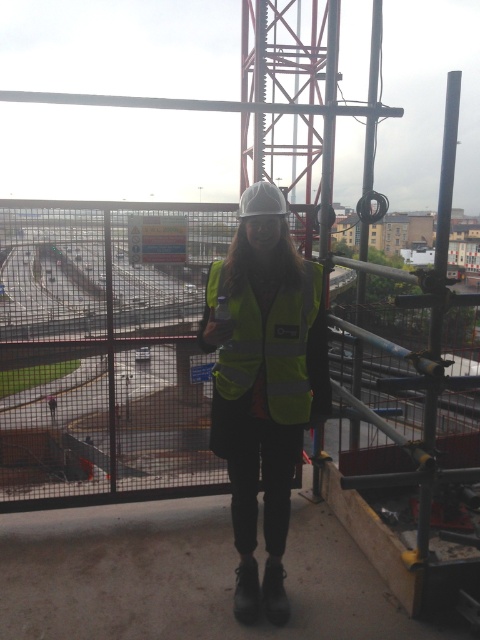
You are a safety inspector at the construction site. You need to ensure that the metal mesh fence at center is tall enough to block the view of the dangerous machinery behind it. Given that the yellow reflective vest at center is worn by a person of average height, can you determine if the fence is tall enough?

The metal mesh fence at center is much taller than the yellow reflective vest at center, which is worn by a person of average height. Therefore, the fence is tall enough to block the view of the dangerous machinery behind it.

You are a safety inspector at the construction site. You notice the metal mesh fence at center and the yellow reflective vest at center. According to safety protocols, the fence should be on the left side of the vest. Is the current positioning compliant with the safety regulations?

The metal mesh fence at center is positioned on the right side of the yellow reflective vest at center, which violates the safety protocol requirement that the fence should be on the left side. Therefore, the current positioning is not compliant with the safety regulations.

You are a safety inspector at the construction site. You need to ensure that the yellow reflective vest at center is visible from the crane operator located at point A. The crane operator is at point A which is at coordinates 0.6, 0.6. Is the vest within the operator s line of sight? Please explain using the coordinates provided.

The yellow reflective vest at center is located at point (264, 381). The crane operator is at point A at coordinates (288, 384). The vest is very close to the operator s position, so it should be within the line of sight.